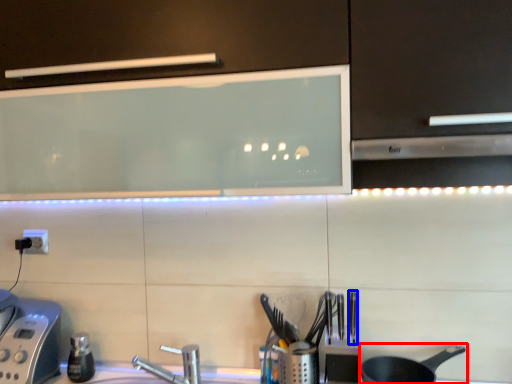
Question: Which of the following is the closest to the observer, frying pan (highlighted by a red box) or silverware (highlighted by a blue box)?

Choices:
 (A) frying pan
 (B) silverware

Answer: (A)